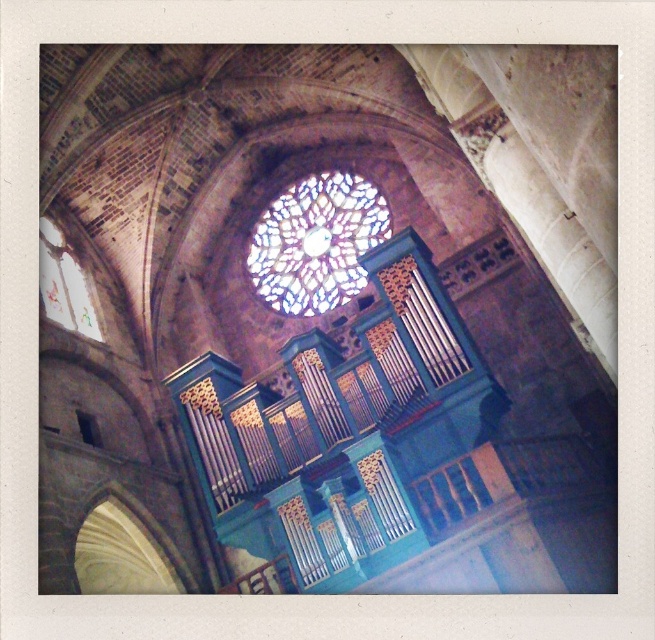
Question: Does stained glass window at center have a lesser width compared to translucent stained glass at upper left?

Choices:
 (A) yes
 (B) no

Answer: (B)

Question: Does stained glass window at center appear on the right side of translucent stained glass at upper left?

Choices:
 (A) yes
 (B) no

Answer: (A)

Question: Is stained glass window at center to the right of translucent stained glass at upper left from the viewer's perspective?

Choices:
 (A) yes
 (B) no

Answer: (A)

Question: Among these points, which one is farthest from the camera?

Choices:
 (A) coord(79,321)
 (B) coord(360,252)

Answer: (B)

Question: Which of the following is the farthest from the observer?

Choices:
 (A) (83, 292)
 (B) (303, 240)

Answer: (B)